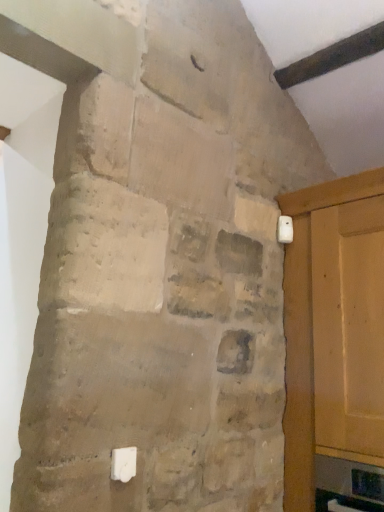
Question: Considering their positions, is matte wood door at right located in front of or behind white plastic light switch at upper right, the 1th light switch in the top-to-bottom sequence?

Choices:
 (A) behind
 (B) front

Answer: (B)

Question: From a real-world perspective, is matte wood door at right physically located above or below white plastic light switch at upper right, positioned as the first light switch in right-to-left order?

Choices:
 (A) above
 (B) below

Answer: (B)

Question: Estimate the real-world distances between objects in this image. Which object is farther from the white plastic light switch at upper right, acting as the 2th light switch starting from the front?

Choices:
 (A) white plastic light switch at lower center, arranged as the 1th light switch when viewed from the left
 (B) matte wood door at right

Answer: (A)

Question: Which of these objects is positioned closest to the white plastic light switch at upper right, the 2th light switch in the left-to-right sequence?

Choices:
 (A) matte wood door at right
 (B) white plastic light switch at lower center, the 1th light switch in the front-to-back sequence

Answer: (A)